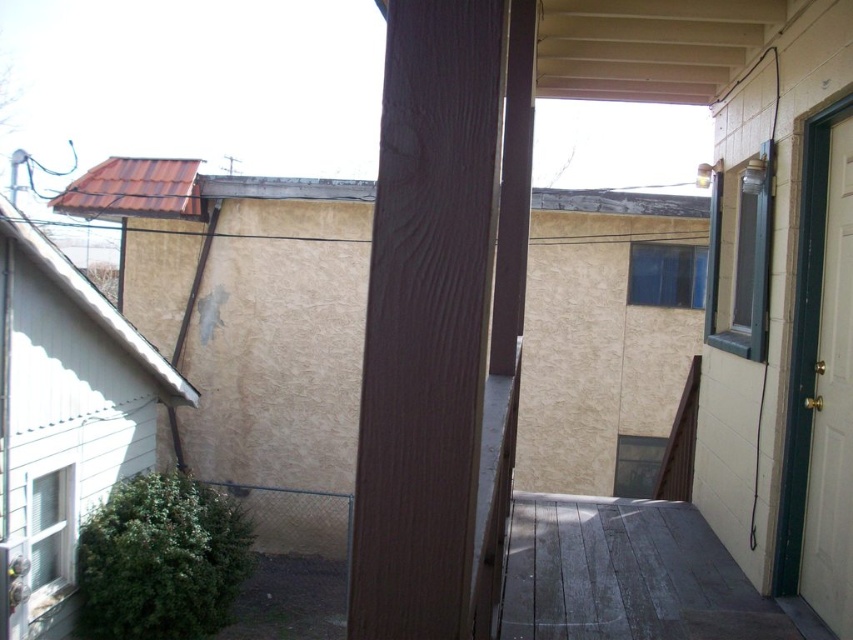
Question: Can you confirm if weathered wood deck at lower center is positioned to the left of white glossy door at right?

Choices:
 (A) no
 (B) yes

Answer: (B)

Question: Is weathered wood deck at lower center wider than white glossy door at right?

Choices:
 (A) no
 (B) yes

Answer: (B)

Question: Can you confirm if weathered wood deck at lower center is positioned above white glossy door at right?

Choices:
 (A) no
 (B) yes

Answer: (A)

Question: Among these objects, which one is farthest from the camera?

Choices:
 (A) weathered wood deck at lower center
 (B) white glossy door at right

Answer: (A)